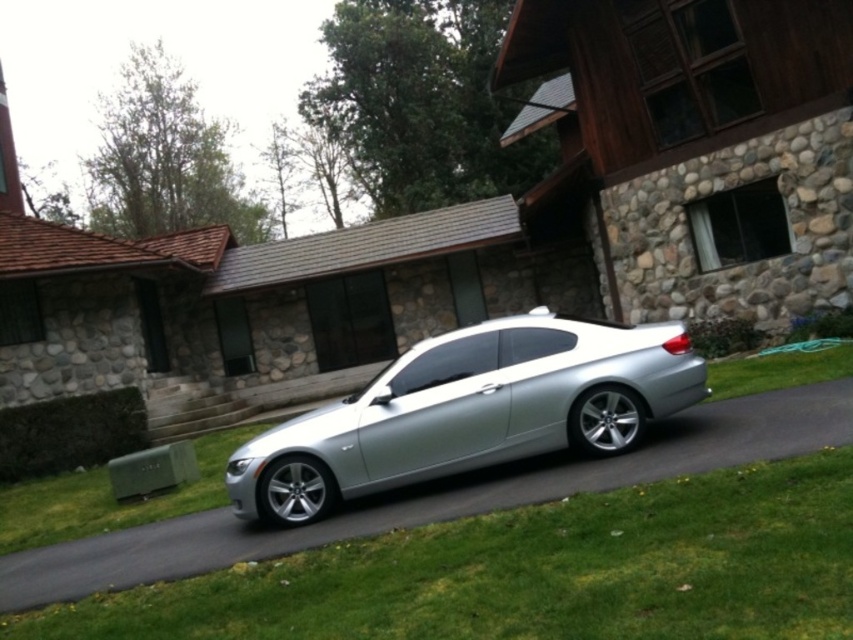
Is point (672, 593) closer to camera compared to point (418, 422)?

Yes.

From the picture: Is green grass at lower right thinner than satin silver car at center?

Incorrect, green grass at lower right's width is not less than satin silver car at center's.

This screenshot has height=640, width=853. Identify the location of green grass at lower right. (537, 572).

Find the location of a particular element. The width and height of the screenshot is (853, 640). green grass at lower right is located at coordinates (537, 572).